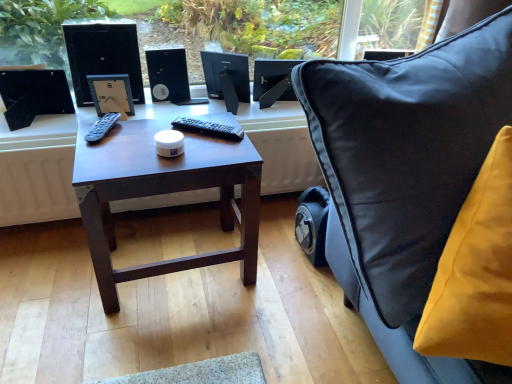
Question: Is black plastic speaker at center positioned with its back to black glossy desktop computer at upper left?

Choices:
 (A) yes
 (B) no

Answer: (B)

Question: Is black plastic speaker at center thinner than black glossy desktop computer at upper left?

Choices:
 (A) yes
 (B) no

Answer: (B)

Question: From a real-world perspective, is black plastic speaker at center on black glossy desktop computer at upper left?

Choices:
 (A) no
 (B) yes

Answer: (A)

Question: Is black plastic speaker at center bigger than black glossy desktop computer at upper left?

Choices:
 (A) yes
 (B) no

Answer: (B)

Question: Does black plastic speaker at center have a greater height compared to black glossy desktop computer at upper left?

Choices:
 (A) yes
 (B) no

Answer: (B)

Question: Considering the positions of dark wood table at center and black matte computer monitor at center, the first computer monitor viewed from the left, in the image, is dark wood table at center taller or shorter than black matte computer monitor at center, the first computer monitor viewed from the left,?

Choices:
 (A) short
 (B) tall

Answer: (B)

Question: In the image, is dark wood table at center on the left side or the right side of black matte computer monitor at center, placed as the second computer monitor when sorted from right to left?

Choices:
 (A) right
 (B) left

Answer: (B)

Question: Looking at their shapes, would you say dark wood table at center is wider or thinner than black matte computer monitor at center, the first computer monitor viewed from the left?

Choices:
 (A) thin
 (B) wide

Answer: (B)

Question: From a real-world perspective, is dark wood table at center physically located above or below black matte computer monitor at center, placed as the second computer monitor when sorted from right to left?

Choices:
 (A) above
 (B) below

Answer: (B)

Question: Considering the positions of black matte computer monitor at center, placed as the second computer monitor when sorted from right to left, and dark wood table at center in the image, is black matte computer monitor at center, placed as the second computer monitor when sorted from right to left, taller or shorter than dark wood table at center?

Choices:
 (A) short
 (B) tall

Answer: (A)

Question: Is black matte computer monitor at center, the first computer monitor viewed from the left, bigger or smaller than dark wood table at center?

Choices:
 (A) small
 (B) big

Answer: (A)

Question: Choose the correct answer: Is black matte computer monitor at center, the first computer monitor viewed from the left, inside dark wood table at center or outside it?

Choices:
 (A) outside
 (B) inside

Answer: (A)

Question: From the image's perspective, relative to dark wood table at center, is black matte computer monitor at center, the first computer monitor viewed from the left, above or below?

Choices:
 (A) below
 (B) above

Answer: (B)

Question: Looking at the image, does black glossy desktop computer at upper left seem bigger or smaller compared to black plastic speaker at center?

Choices:
 (A) small
 (B) big

Answer: (B)

Question: Which is correct: black glossy desktop computer at upper left is inside black plastic speaker at center, or outside of it?

Choices:
 (A) inside
 (B) outside

Answer: (B)